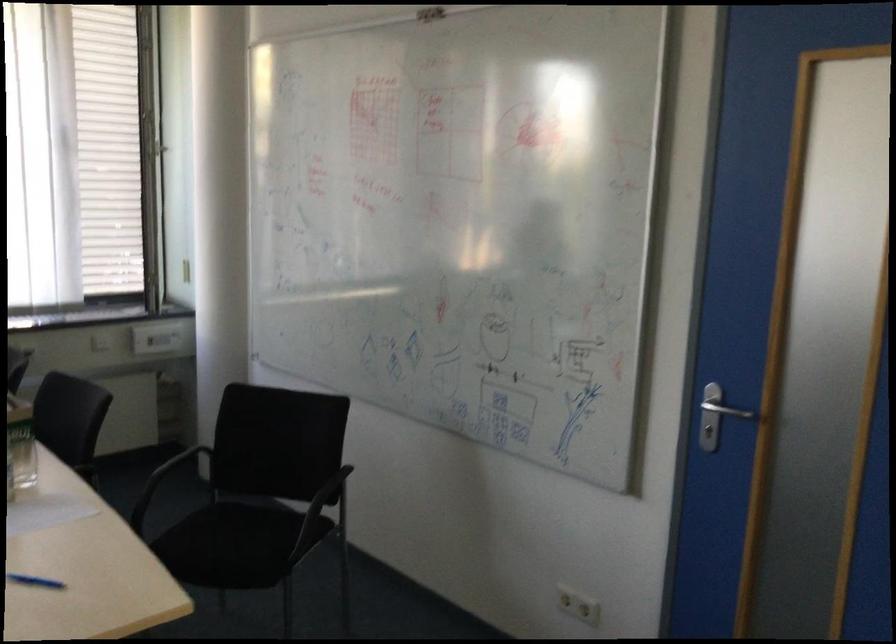
Where would you sit the black chair sitting surface? Please return your answer as a coordinate pair (x, y).

(251, 529)